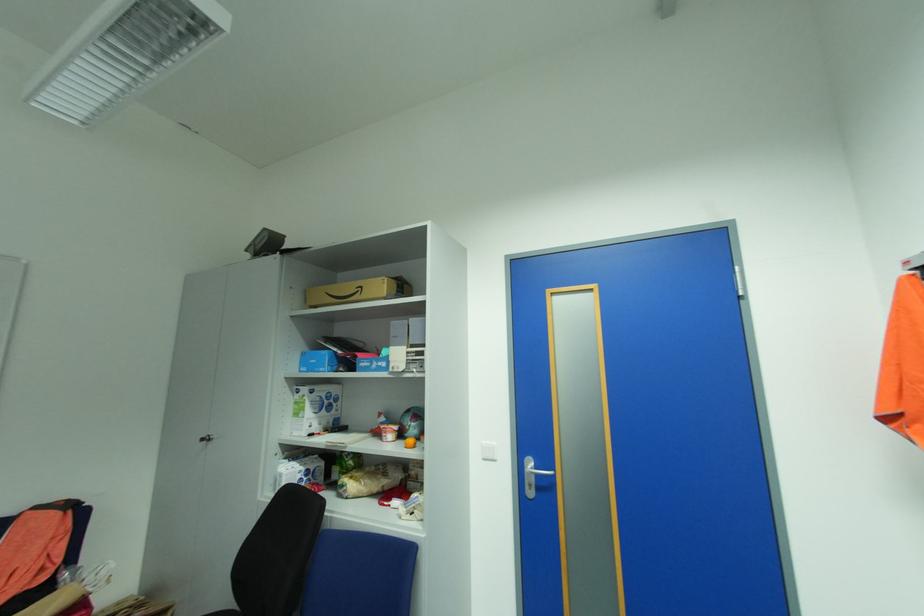
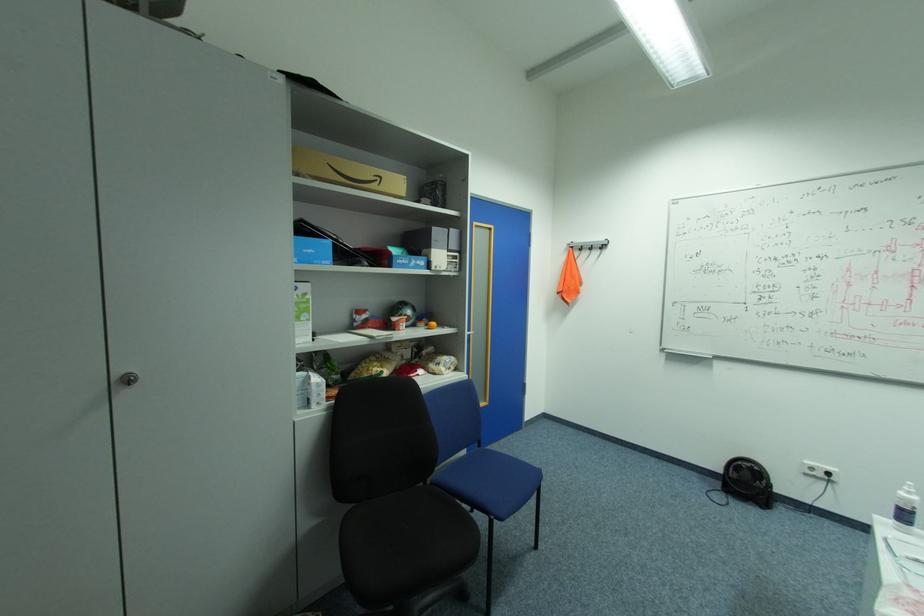
Locate, in the second image, the point that corresponds to [380,468] in the first image.

(380, 358)